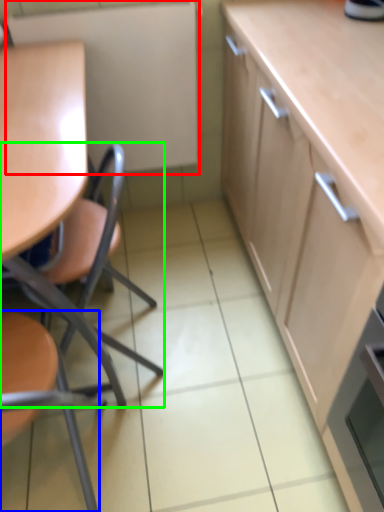
Question: Which object is the closest to the appliance (highlighted by a red box)? Choose among these: chair (highlighted by a blue box) or chair (highlighted by a green box).

Choices:
 (A) chair
 (B) chair

Answer: (B)